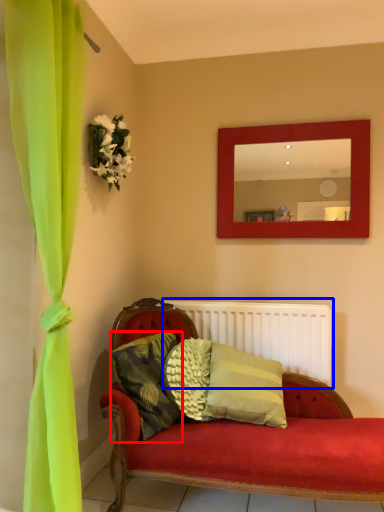
Question: Which object appears farthest to the camera in this image, pillow (highlighted by a red box) or radiator (highlighted by a blue box)?

Choices:
 (A) pillow
 (B) radiator

Answer: (B)